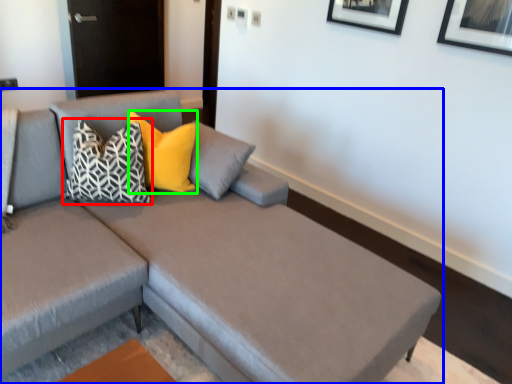
Question: Considering the real-world distances, which object is closest to pillow (highlighted by a red box)? studio couch (highlighted by a blue box) or pillow (highlighted by a green box).

Choices:
 (A) studio couch
 (B) pillow

Answer: (B)